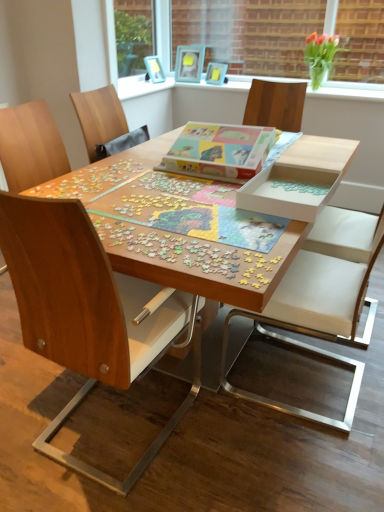
At what (x,y) coordinates should I click in order to perform the action: click on free point above wooden puzzle pieces at center, which is the second jigsaw puzzle from top to bottom (from a real-world perspective). Please return your answer as a coordinate pair (x, y). The image size is (384, 512). Looking at the image, I should click on (192, 200).